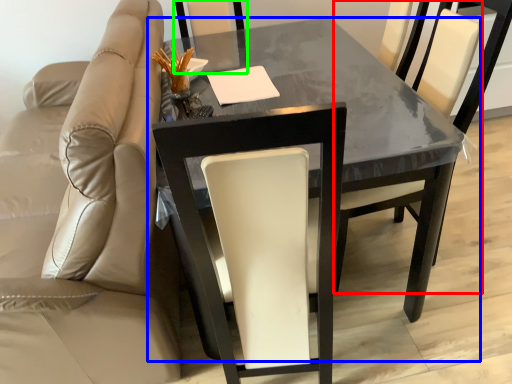
Question: Which object is positioned farthest from chair (highlighted by a red box)? Select from table (highlighted by a blue box) and chair (highlighted by a green box).

Choices:
 (A) table
 (B) chair

Answer: (B)